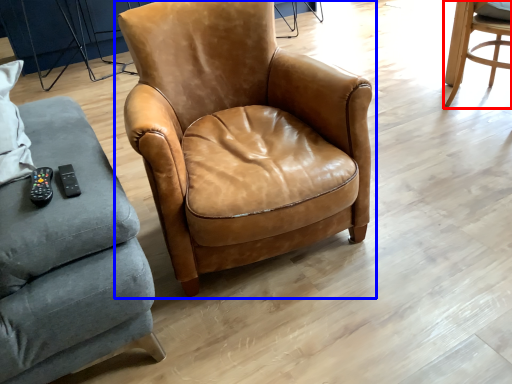
Question: Which point is closer to the camera, chair (highlighted by a red box) or chair (highlighted by a blue box)?

Choices:
 (A) chair
 (B) chair

Answer: (B)